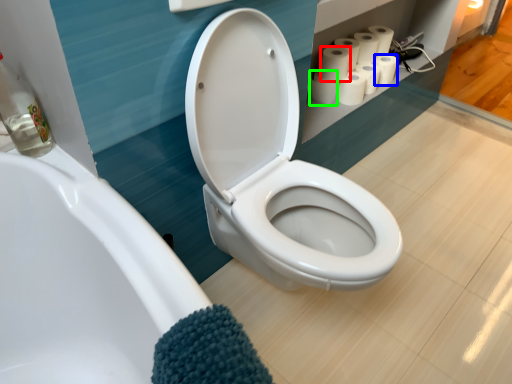
Question: Considering the real-world distances, which object is closest to toilet paper (highlighted by a red box)? toilet paper (highlighted by a blue box) or toilet paper (highlighted by a green box).

Choices:
 (A) toilet paper
 (B) toilet paper

Answer: (B)